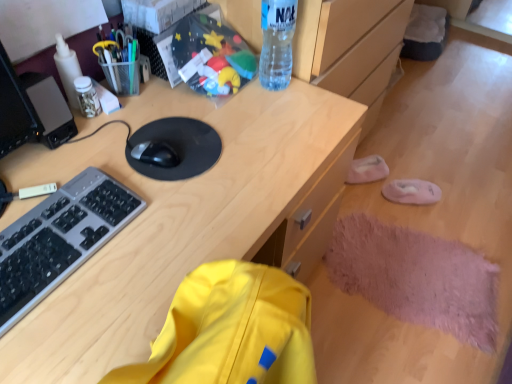
Question: Is gray plastic keyboard at left taller or shorter than translucent plastic jar at upper left, which is counted as the 2th stationery, starting from the right?

Choices:
 (A) tall
 (B) short

Answer: (B)

Question: Considering their positions, is gray plastic keyboard at left located in front of or behind translucent plastic jar at upper left, positioned as the 1th stationery in left-to-right order?

Choices:
 (A) behind
 (B) front

Answer: (B)

Question: Which is nearer to the white plastic bottle at upper left, the 2th bottle from the right?

Choices:
 (A) transparent plastic bottle at upper center, positioned as the first bottle in right-to-left order
 (B) metallic pen holder at upper left, positioned as the first stationery in right-to-left order
 (C) translucent plastic jar at upper left, which is counted as the 2th stationery, starting from the right
 (D) black matte mouse at center
 (E) wooden desk at center

Answer: (C)

Question: Estimate the real-world distances between objects in this image. Which object is closer to the gray plastic keyboard at left?

Choices:
 (A) metallic pen holder at upper left, positioned as the first stationery in right-to-left order
 (B) white plastic bottle at upper left, which ranks as the first bottle in left-to-right order
 (C) wooden desk at center
 (D) transparent plastic bottle at upper center, the second bottle in the left-to-right sequence
 (E) translucent plastic jar at upper left, which is counted as the 2th stationery, starting from the right

Answer: (C)